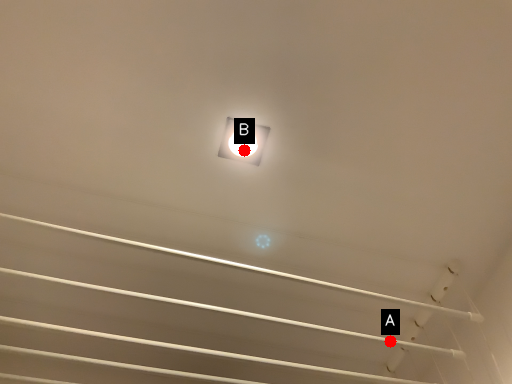
Question: Two points are circled on the image, labeled by A and B beside each circle. Which of the following is the farthest from the observer?

Choices:
 (A) A is further
 (B) B is further

Answer: (A)